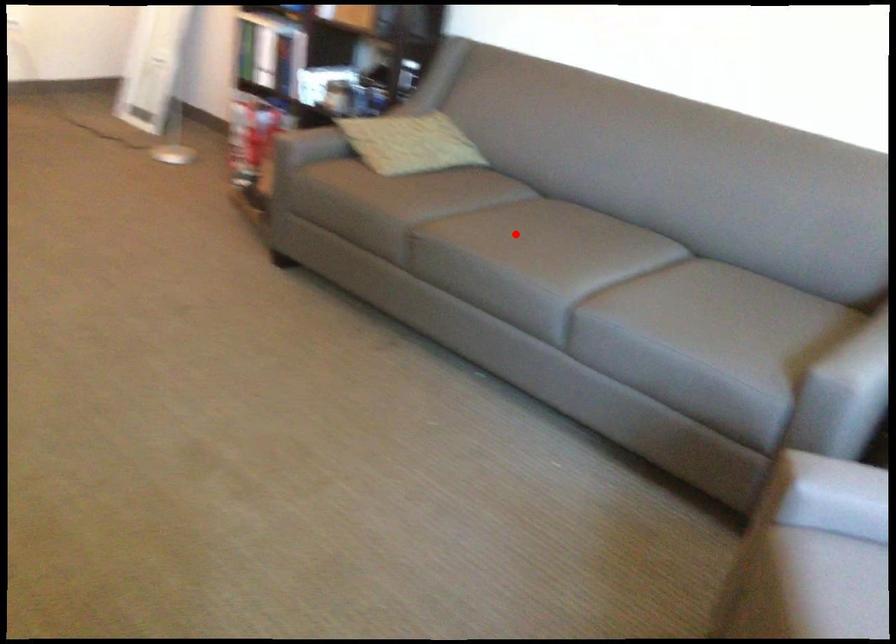
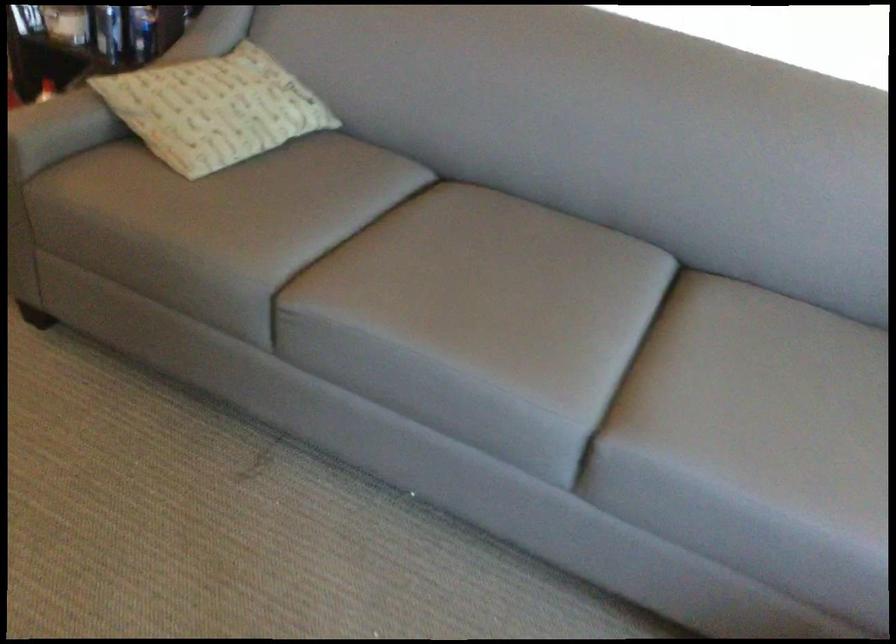
In the second image, find the point that corresponds to the highlighted location in the first image.

(479, 290)